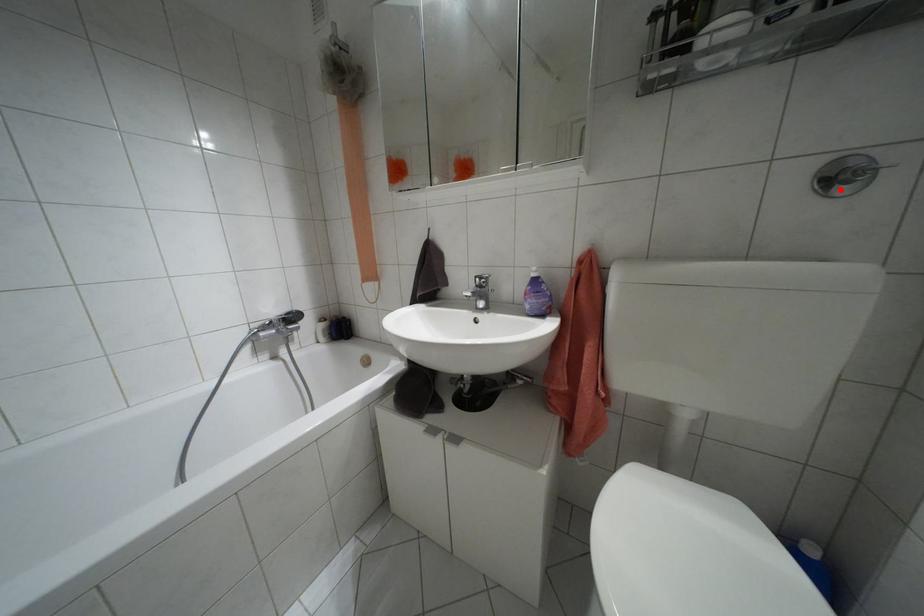
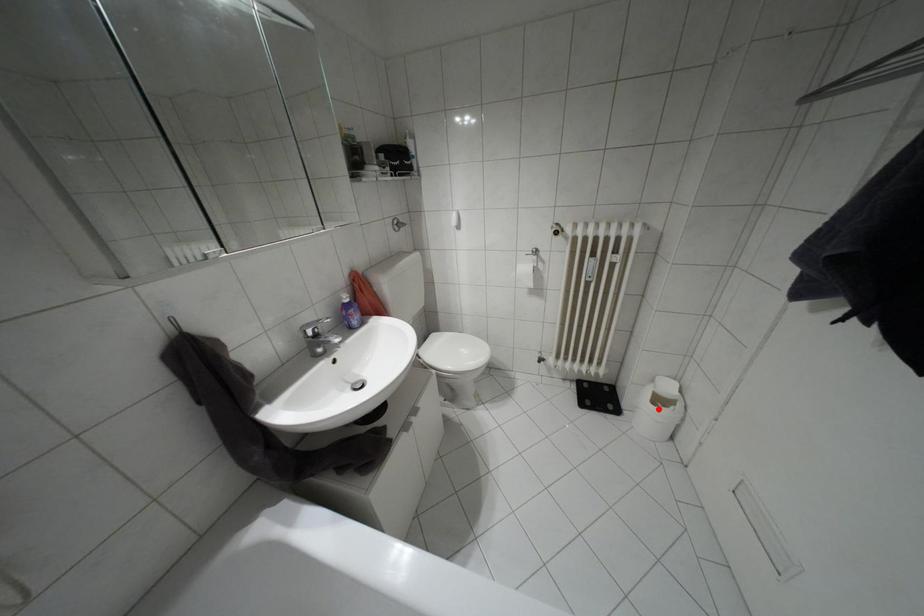
I am providing you with two images of the same scene from different viewpoints. A red point is marked on the first image and another point is marked on the second image. Is the marked point in image1 the same physical position as the marked point in image2?

No